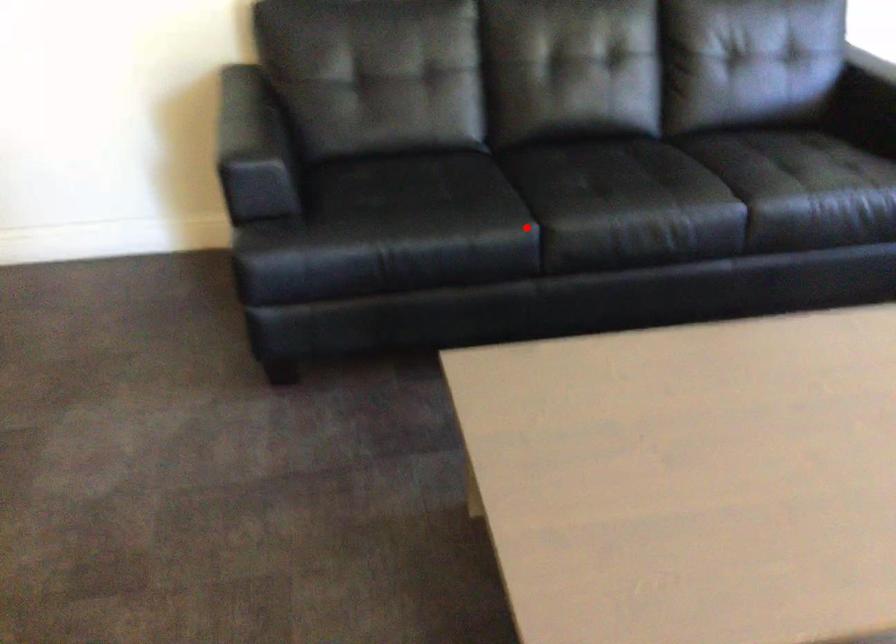
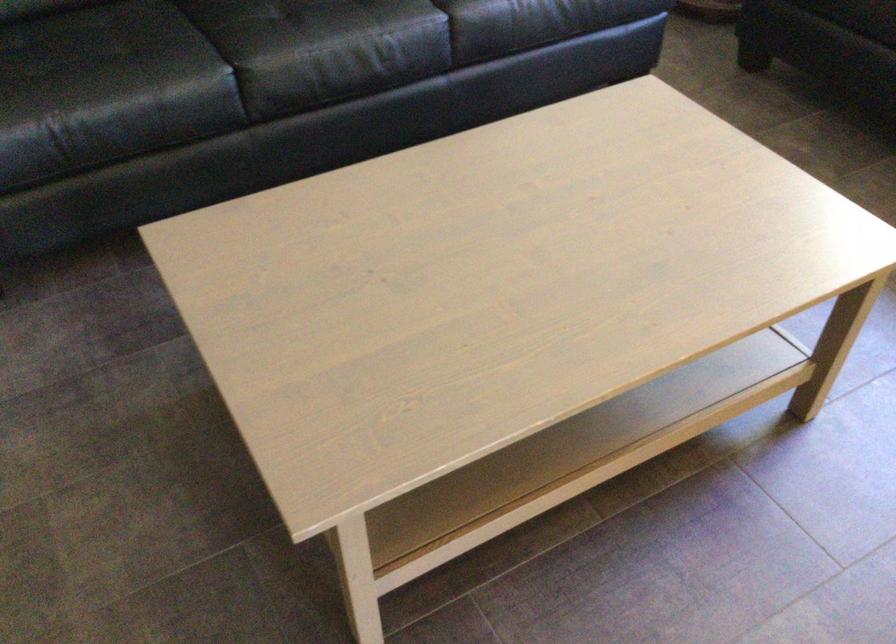
Question: I am providing you with two images of the same scene from different viewpoints. Given a red point in image1, look at the same physical point in image2. Is it:

Choices:
 (A) Closer to the viewpoint
 (B) Farther from the viewpoint

Answer: (A)